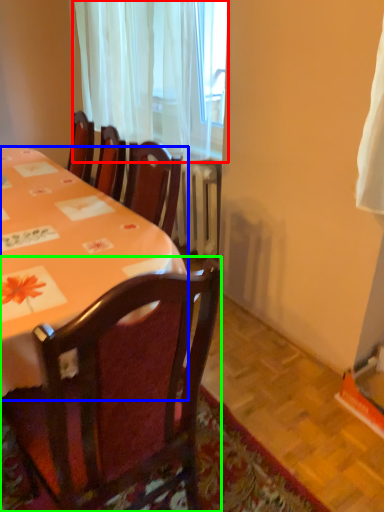
Question: Which is farther away from curtain (highlighted by a red box)? desk (highlighted by a blue box) or chair (highlighted by a green box)?

Choices:
 (A) desk
 (B) chair

Answer: (B)